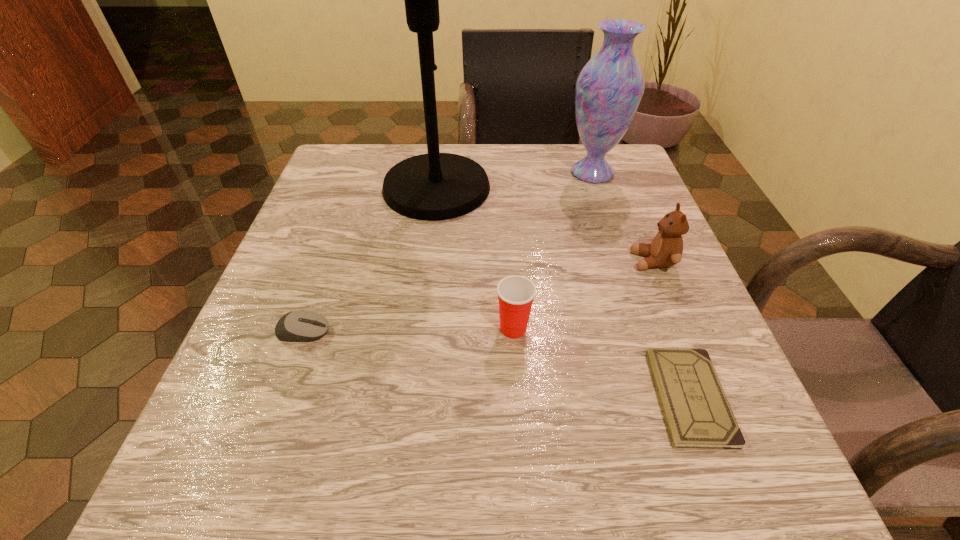
Find the location of `vacant space in between the table lamp and the vase`. vacant space in between the table lamp and the vase is located at coordinates (515, 180).

The width and height of the screenshot is (960, 540). I want to click on empty space that is in between the vase and the computer equipment, so click(x=448, y=252).

The image size is (960, 540). Identify the location of empty space that is in between the fourth tallest object and the teddy bear. pyautogui.click(x=583, y=295).

In order to click on free space between the teddy bear and the table lamp in this screenshot , I will do `click(544, 225)`.

This screenshot has width=960, height=540. I want to click on the fourth closest object to the second shortest object, so click(x=666, y=248).

Identify which object is located as the nearest to the computer equipment. Please provide its 2D coordinates. Your answer should be formatted as a tuple, i.e. [(x, y)], where the tuple contains the x and y coordinates of a point satisfying the conditions above.

[(435, 186)]

Image resolution: width=960 pixels, height=540 pixels. What are the coordinates of `vacant position in the image that satisfies the following two spatial constraints: 1. on the front side of the third shortest object; 2. on the right side of the checkbook` in the screenshot? It's located at (518, 397).

Image resolution: width=960 pixels, height=540 pixels. I want to click on blank area in the image that satisfies the following two spatial constraints: 1. on the back side of the checkbook; 2. on the wheel side of the computer equipment, so click(665, 332).

In order to click on vacant position in the image that satisfies the following two spatial constraints: 1. on the back side of the vase; 2. on the left side of the table lamp in this screenshot , I will do `click(439, 173)`.